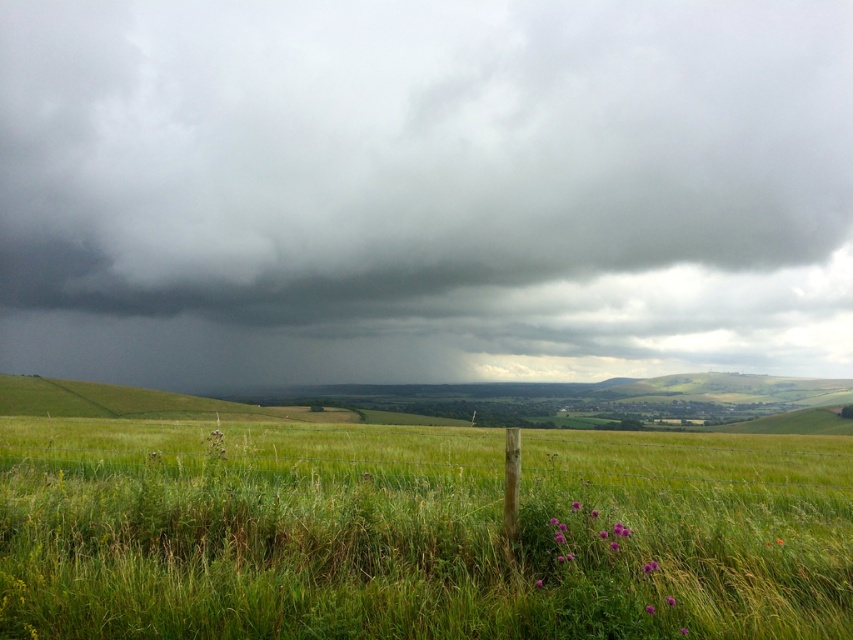
Is dark gray cloud at upper center to the right of green grassy field at lower center from the viewer's perspective?

Incorrect, dark gray cloud at upper center is not on the right side of green grassy field at lower center.

Is dark gray cloud at upper center smaller than green grassy field at lower center?

No, dark gray cloud at upper center is not smaller than green grassy field at lower center.

Who is more forward, (523,22) or (633,448)?

Point (633,448)

Where is `dark gray cloud at upper center`? The width and height of the screenshot is (853, 640). dark gray cloud at upper center is located at coordinates (422, 189).